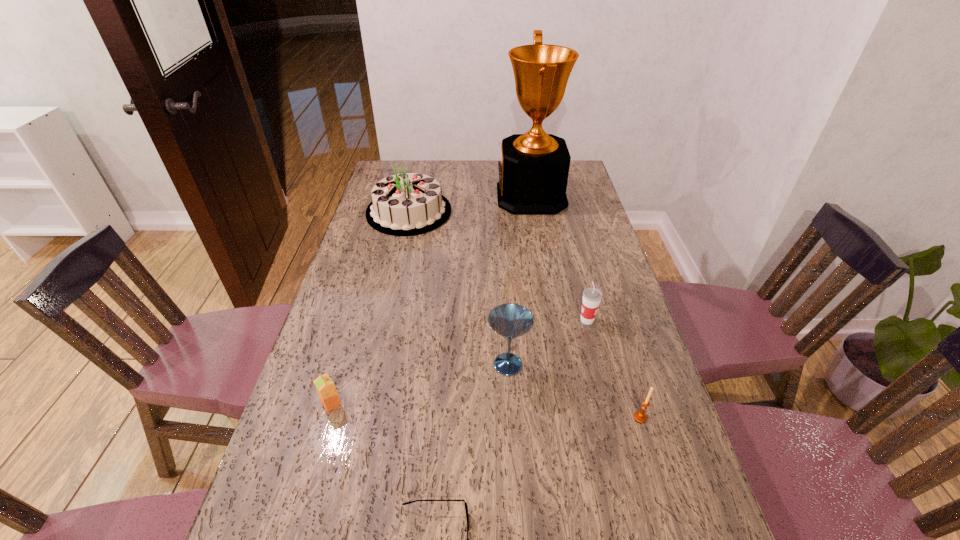
Locate an element on the screen. vacant point that satisfies the following two spatial constraints: 1. on the back side of the rightmost object; 2. on the front of the trophy cup with the label is located at coordinates (573, 197).